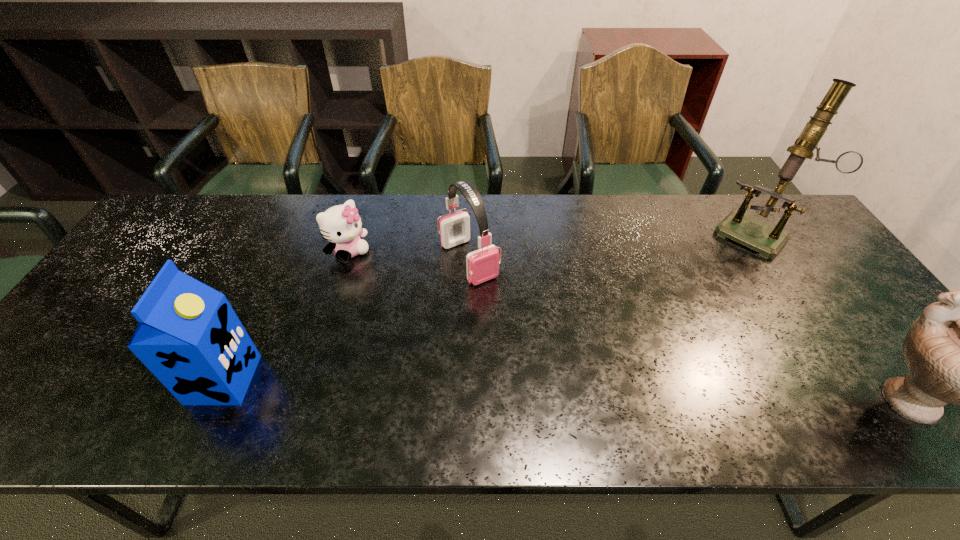
I want to click on carton, so click(188, 335).

Find the location of a particular element. earphone is located at coordinates (483, 264).

The image size is (960, 540). In order to click on the third object from right to left in this screenshot , I will do `click(483, 264)`.

The image size is (960, 540). I want to click on microscope, so click(768, 240).

Locate an element on the screen. The width and height of the screenshot is (960, 540). kitten is located at coordinates (341, 225).

Image resolution: width=960 pixels, height=540 pixels. What are the coordinates of `the shortest object` in the screenshot? It's located at (341, 225).

Find the location of `vacant area located 0.070m with the cap open on the leftmost object`. vacant area located 0.070m with the cap open on the leftmost object is located at coordinates (283, 380).

This screenshot has height=540, width=960. I want to click on free location located on the outer surface of the earphone, so click(x=547, y=368).

I want to click on vacant space located on the outer surface of the earphone, so click(513, 323).

Locate an element on the screen. This screenshot has height=540, width=960. vacant space situated 0.130m on the outer surface of the earphone is located at coordinates (509, 318).